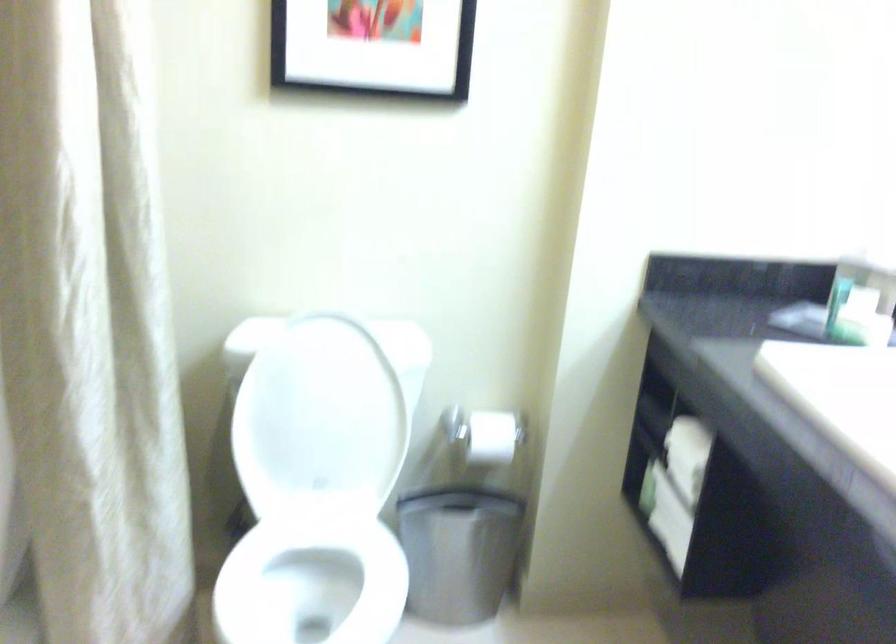
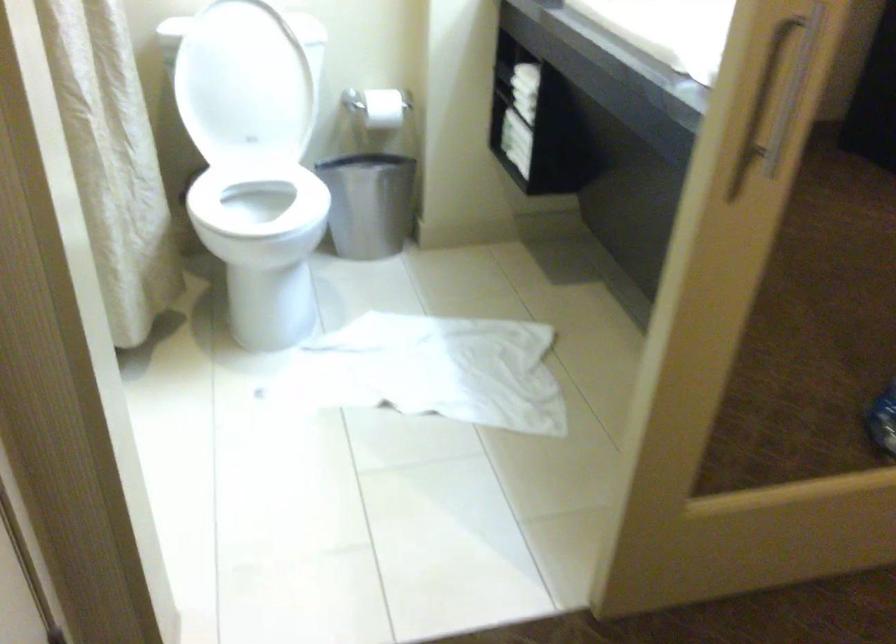
Question: How did the camera likely rotate?

Choices:
 (A) Left
 (B) Right
 (C) Up
 (D) Down

Answer: (D)